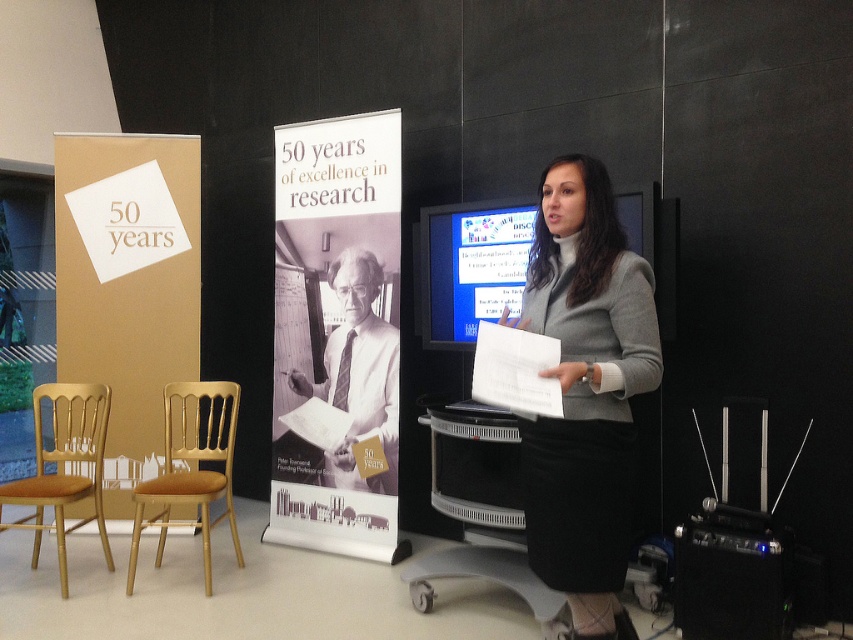
You are an event organizer who needs to move the black plastic speaker at lower right and the gold wood chair at lower left closer to the stage. Which object should you move first to ensure they are both positioned near the stage without blocking the presenter?

The black plastic speaker at lower right is closer to the viewer than the gold wood chair at lower left, so you should move the gold wood chair at lower left first to bring it nearer to the stage while avoiding blocking the presenter.

You are an attendee at the conference and want to sit down. You see the matte gold poster at left and the gold wood chair at lower left. Which object is closer to you as you approach the stage?

The matte gold poster at left is closer to you than the gold wood chair at lower left because it is further to the viewer.